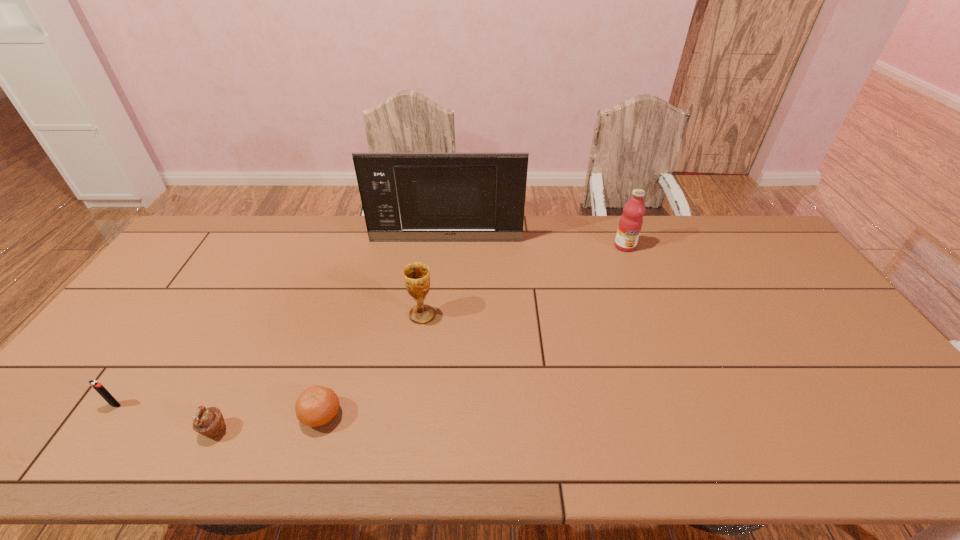
This screenshot has height=540, width=960. Identify the location of vacant space at the near edge of the desktop. (565, 465).

Find the location of a particular element. Image resolution: width=960 pixels, height=540 pixels. free region at the left edge of the desktop is located at coordinates (206, 267).

Locate an element on the screen. The image size is (960, 540). free space at the far left corner is located at coordinates (200, 254).

Locate an element on the screen. This screenshot has height=540, width=960. blank region between the fruit juice and the chalice is located at coordinates [x=523, y=280].

Find the location of a particular element. Image resolution: width=960 pixels, height=540 pixels. free space between the third farthest object and the leftmost object is located at coordinates (269, 360).

Where is `free spot between the third tallest object and the clementine`? free spot between the third tallest object and the clementine is located at coordinates (372, 365).

Find the location of a particular element. free spot between the fruit juice and the clementine is located at coordinates (473, 330).

This screenshot has height=540, width=960. Identify the location of vacant space that's between the fruit juice and the fourth shortest object. (523, 280).

The image size is (960, 540). Identify the location of free space between the igniter and the tallest object. (280, 322).

Locate an element on the screen. The image size is (960, 540). free point between the chalice and the tallest object is located at coordinates (434, 278).